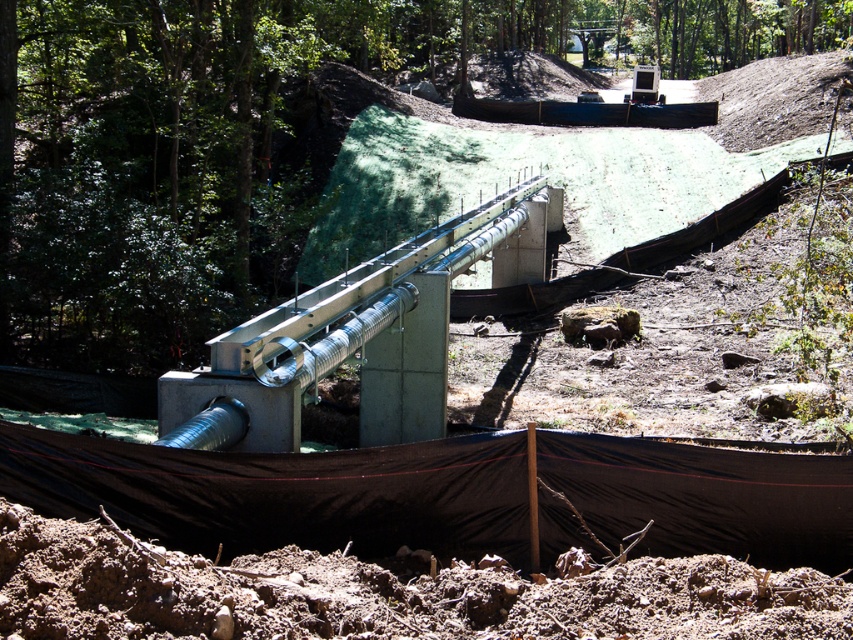
Question: Which point appears farthest from the camera in this image?

Choices:
 (A) (254, 144)
 (B) (403, 416)

Answer: (A)

Question: Among these points, which one is farthest from the camera?

Choices:
 (A) (805, 28)
 (B) (474, 237)

Answer: (A)

Question: Is green textured fabric at center smaller than silver metallic rail at center?

Choices:
 (A) yes
 (B) no

Answer: (B)

Question: Is green textured fabric at center thinner than silver metallic rail at center?

Choices:
 (A) no
 (B) yes

Answer: (A)

Question: Can you confirm if green textured fabric at center is wider than silver metallic rail at center?

Choices:
 (A) yes
 (B) no

Answer: (A)